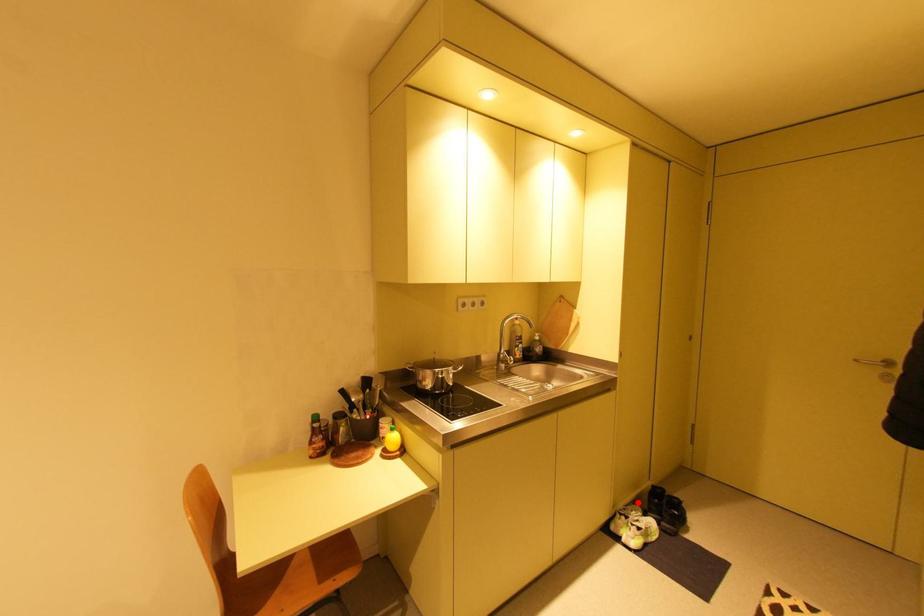
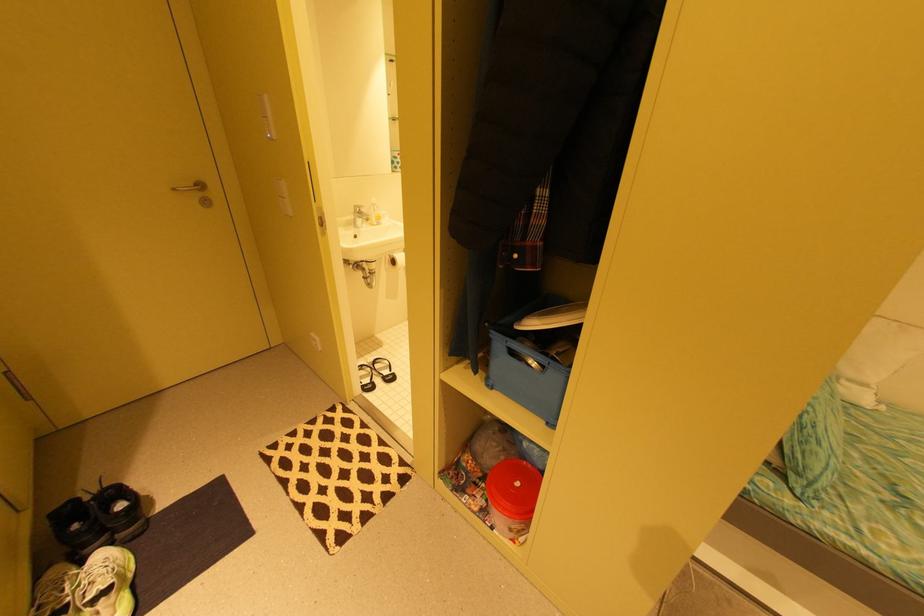
The point at the highlighted location is marked in the first image. Where is the corresponding point in the second image?

(44, 578)